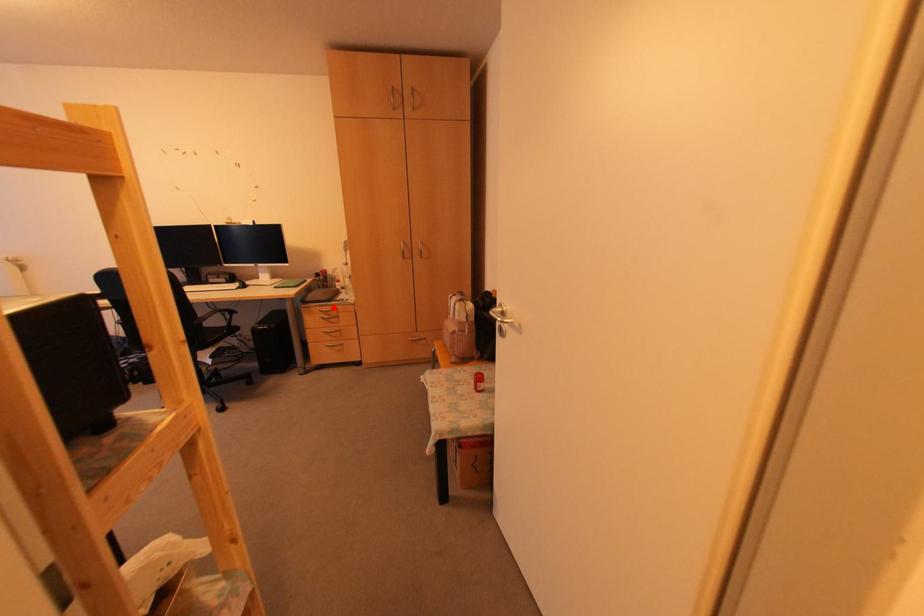
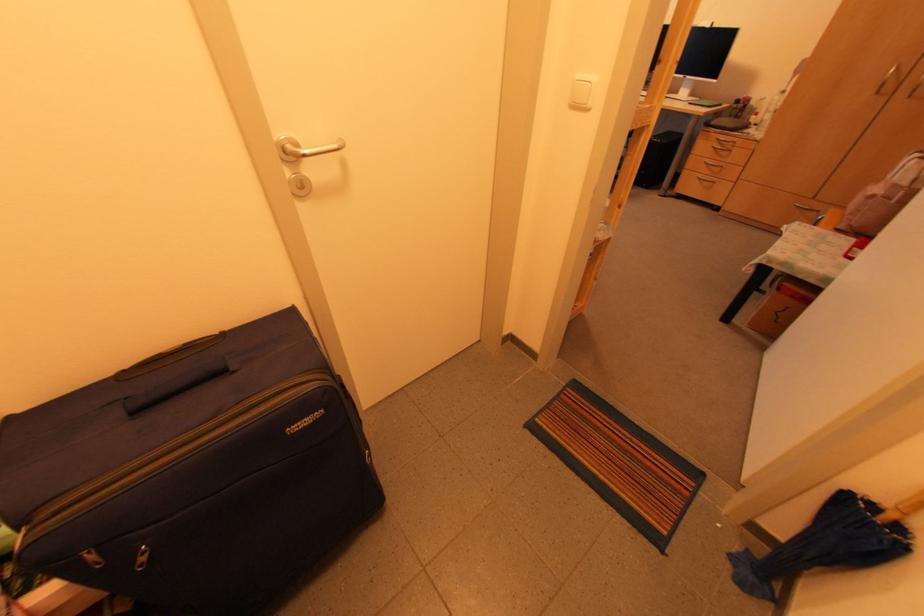
In the second image, find the point that corresponds to the highlighted location in the first image.

(734, 140)